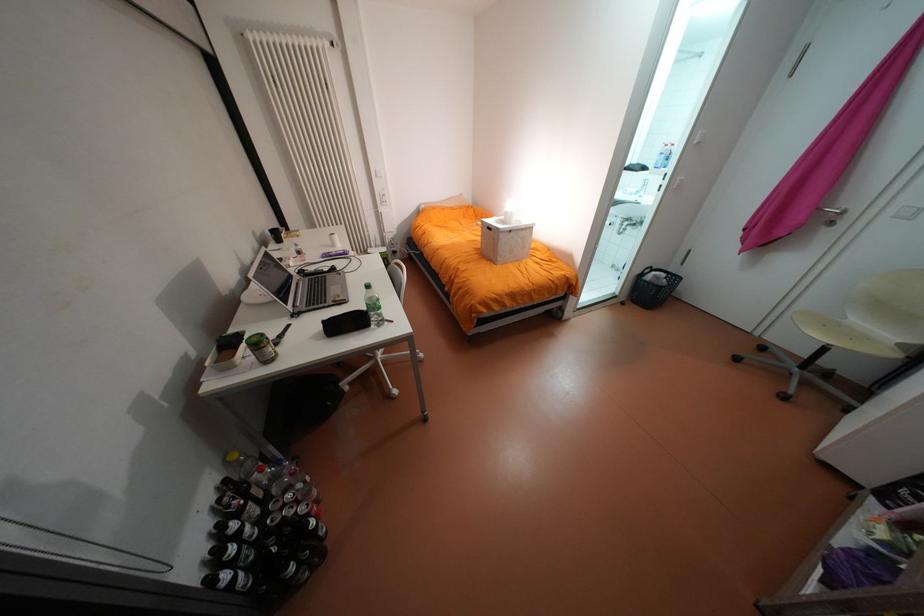
Find where to turn the silver door handle. Please return your answer as a coordinate pair (x, y).

(832, 214)